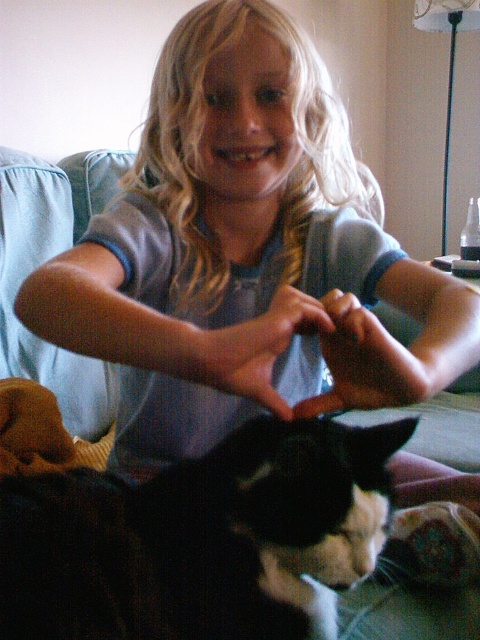
Question: Among these objects, which one is nearest to the camera?

Choices:
 (A) matte blue shirt at center
 (B) black fur cat at lower left

Answer: (B)

Question: Is matte blue shirt at center thinner than black fur cat at lower left?

Choices:
 (A) yes
 (B) no

Answer: (B)

Question: Is matte blue shirt at center closer to camera compared to black fur cat at lower left?

Choices:
 (A) yes
 (B) no

Answer: (B)

Question: Among these objects, which one is nearest to the camera?

Choices:
 (A) black fur cat at lower left
 (B) matte blue shirt at center

Answer: (A)

Question: Among these objects, which one is farthest from the camera?

Choices:
 (A) black fur cat at lower left
 (B) matte blue shirt at center

Answer: (B)

Question: In this image, where is matte blue shirt at center located relative to black fur cat at lower left?

Choices:
 (A) below
 (B) above

Answer: (B)